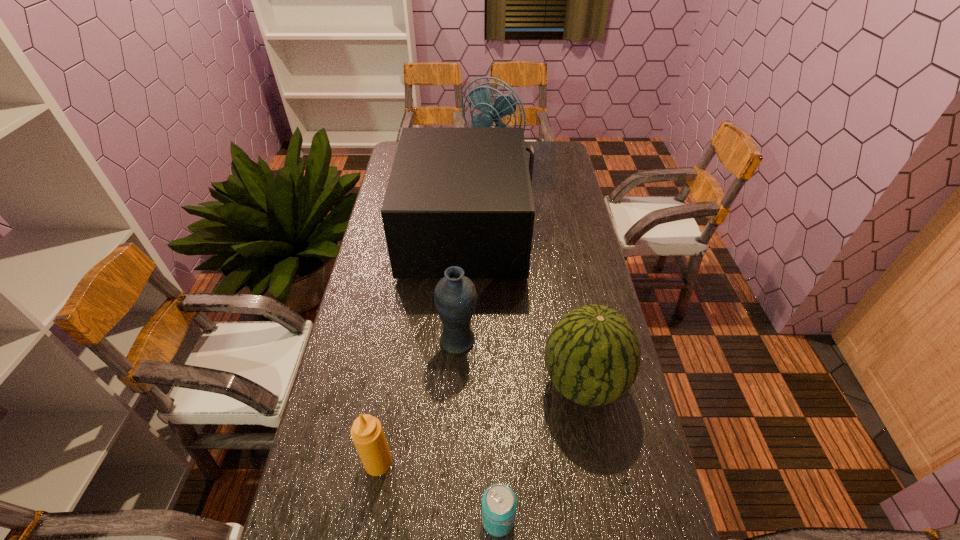
At what (x,y) coordinates should I click in order to perform the action: click on the farthest object. Please return your answer as a coordinate pair (x, y). Looking at the image, I should click on (480, 97).

Where is `fan`? This screenshot has height=540, width=960. fan is located at coordinates (480, 97).

Find the location of a particular element. This screenshot has width=960, height=540. microwave oven is located at coordinates (462, 197).

You are a GUI agent. You are given a task and a screenshot of the screen. Output one action in this format:
    pyautogui.click(x=<x>, y=<y>)
    Task: Click on the vase
    
    Given the screenshot: What is the action you would take?
    pyautogui.click(x=455, y=297)

I want to click on watermelon, so click(x=592, y=355).

Image resolution: width=960 pixels, height=540 pixels. In order to click on condiment in this screenshot , I will do [x=367, y=433].

The height and width of the screenshot is (540, 960). What are the coordinates of `the second shortest object` in the screenshot? It's located at (367, 433).

This screenshot has height=540, width=960. Find the location of `the nearest object`. the nearest object is located at coordinates (499, 503).

Image resolution: width=960 pixels, height=540 pixels. In order to click on beer can in this screenshot , I will do `click(499, 503)`.

Locate an element on the screen. This screenshot has width=960, height=540. vacant space located 0.290m in front of the farthest object to blow air is located at coordinates (493, 207).